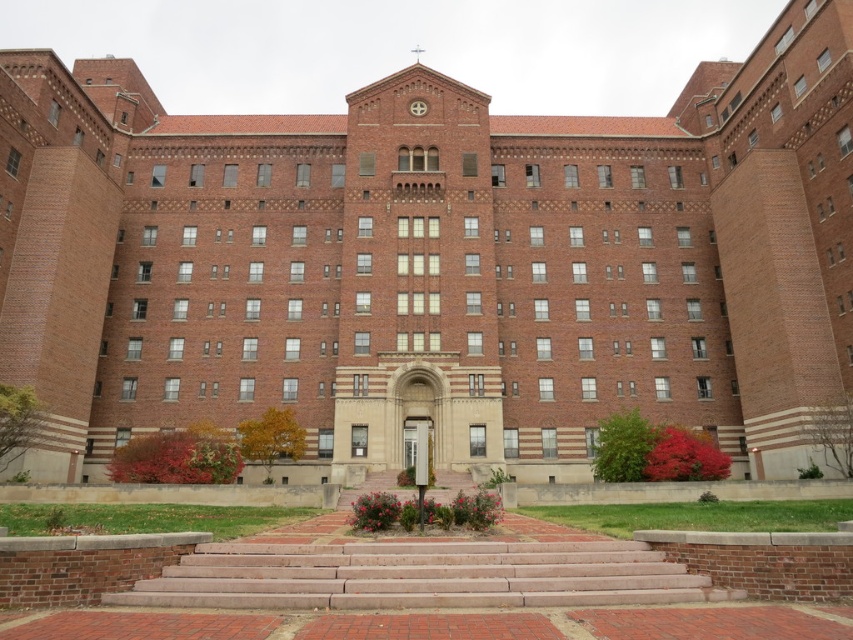
Question: Which point is farther to the camera?

Choices:
 (A) brick stairs at center
 (B) matte brick clock at center

Answer: (B)

Question: Which of the following is the farthest from the observer?

Choices:
 (A) brick stairs at center
 (B) matte brick clock at center

Answer: (B)

Question: Is brick stairs at center wider than matte brick clock at center?

Choices:
 (A) yes
 (B) no

Answer: (A)

Question: Is brick stairs at center further to camera compared to matte brick clock at center?

Choices:
 (A) yes
 (B) no

Answer: (B)

Question: Can you confirm if brick stairs at center is positioned to the right of matte brick clock at center?

Choices:
 (A) yes
 (B) no

Answer: (A)

Question: Which of the following is the closest to the observer?

Choices:
 (A) (412, 113)
 (B) (326, 586)

Answer: (B)